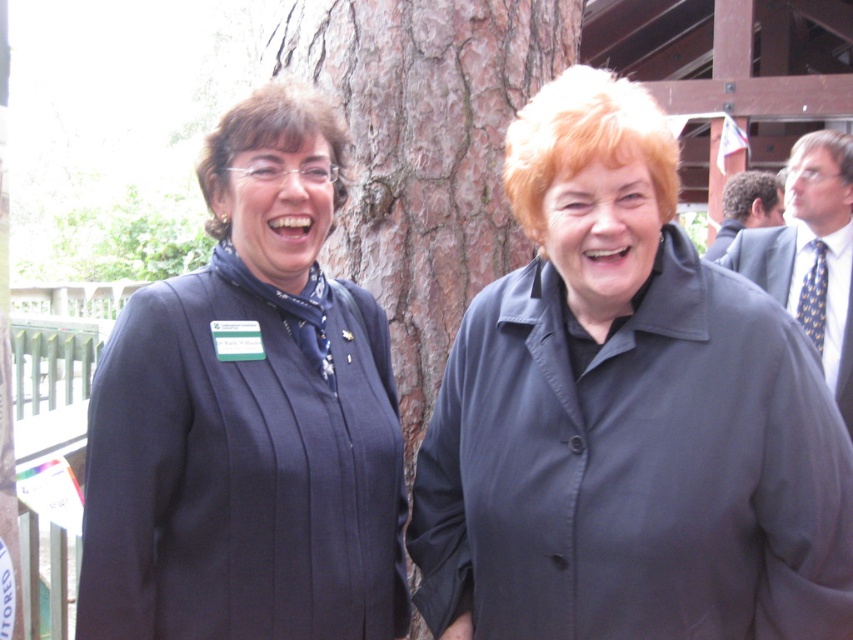
You are a photographer trying to capture a closeup of the brown rough bark at center. Given that your camera has a focus range of 1 meter, and you are currently standing 2 meters away from the bark, can you adjust your position to get a clear shot without moving the bark?

The brown rough bark at center is located at point coordinates, but the exact distance isn